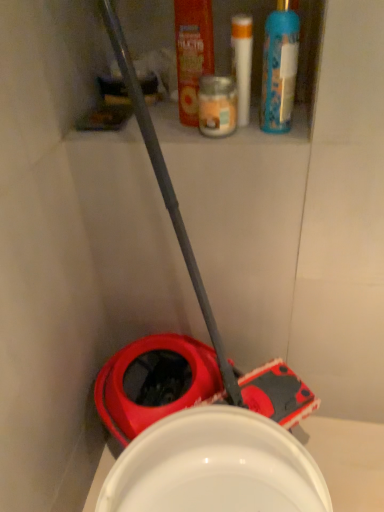
You are a GUI agent. You are given a task and a screenshot of the screen. Output one action in this format:
    pyautogui.click(x=<x>, y=<y>)
    Task: Click on the blue plastic spray bottle at upper right
    
    Given the screenshot: What is the action you would take?
    pyautogui.click(x=279, y=68)

What is the approximate width of orange plastic mouthwash at upper center?

It is 2.71 inches.

Where is `blue plastic spray bottle at upper right`? blue plastic spray bottle at upper right is located at coordinates (279, 68).

Which is closer to the camera, [227,77] or [180,20]?

Point [227,77] appears to be closer to the viewer than point [180,20].

Does translucent glass candle at upper center, arranged as the second toiletry when viewed from the right, turn towards orange plastic mouthwash at upper center?

No, translucent glass candle at upper center, arranged as the second toiletry when viewed from the right, is not turned towards orange plastic mouthwash at upper center.

Consider the image. Is translucent glass candle at upper center, arranged as the second toiletry when viewed from the right, taller than orange plastic mouthwash at upper center?

Incorrect, the height of translucent glass candle at upper center, arranged as the second toiletry when viewed from the right, is not larger of that of orange plastic mouthwash at upper center.

Based on the photo, is the position of white plastic tube at upper center, the 1th toiletry in the right-to-left sequence, more distant than that of blue plastic spray bottle at upper right?

Yes, it is behind blue plastic spray bottle at upper right.

Could you tell me if white plastic tube at upper center, which is counted as the second toiletry, starting from the left, is facing blue plastic spray bottle at upper right?

No, white plastic tube at upper center, which is counted as the second toiletry, starting from the left, is not aimed at blue plastic spray bottle at upper right.

Between point (243, 95) and point (273, 41), which one is positioned behind?

Point (273, 41)

Does orange plastic mouthwash at upper center appear on the right side of white plastic tube at upper center, the 1th toiletry in the right-to-left sequence?

Incorrect, orange plastic mouthwash at upper center is not on the right side of white plastic tube at upper center, the 1th toiletry in the right-to-left sequence.

Do you think orange plastic mouthwash at upper center is within white plastic tube at upper center, which is counted as the second toiletry, starting from the left, or outside of it?

orange plastic mouthwash at upper center is not inside white plastic tube at upper center, which is counted as the second toiletry, starting from the left, it's outside.

Looking at the image, does orange plastic mouthwash at upper center seem bigger or smaller compared to white plastic tube at upper center, which is counted as the second toiletry, starting from the left?

In the image, orange plastic mouthwash at upper center appears to be larger than white plastic tube at upper center, which is counted as the second toiletry, starting from the left.

Is orange plastic mouthwash at upper center wider or thinner than white plastic tube at upper center, the 1th toiletry in the right-to-left sequence?

orange plastic mouthwash at upper center is thinner than white plastic tube at upper center, the 1th toiletry in the right-to-left sequence.

Where is `cleaning product in front of the orange plastic mouthwash at upper center`? cleaning product in front of the orange plastic mouthwash at upper center is located at coordinates (279, 68).

Between blue plastic spray bottle at upper right and orange plastic mouthwash at upper center, which one has smaller size?

With smaller size is orange plastic mouthwash at upper center.

From the image's perspective, which is above, blue plastic spray bottle at upper right or orange plastic mouthwash at upper center?

orange plastic mouthwash at upper center.

Is blue plastic spray bottle at upper right in front of or behind orange plastic mouthwash at upper center in the image?

blue plastic spray bottle at upper right is in front of orange plastic mouthwash at upper center.

Does point (223, 133) appear closer or farther from the camera than point (277, 89)?

Point (223, 133).

Between translucent glass candle at upper center, the 1th toiletry when ordered from left to right, and blue plastic spray bottle at upper right, which one has larger size?

Bigger between the two is blue plastic spray bottle at upper right.

Is translucent glass candle at upper center, the 1th toiletry when ordered from left to right, facing towards blue plastic spray bottle at upper right?

No, translucent glass candle at upper center, the 1th toiletry when ordered from left to right, is not aimed at blue plastic spray bottle at upper right.

Which object is positioned more to the right, translucent glass candle at upper center, arranged as the second toiletry when viewed from the right, or blue plastic spray bottle at upper right?

Positioned to the right is blue plastic spray bottle at upper right.

Do you think white plastic tube at upper center, the 1th toiletry in the right-to-left sequence, is within orange plastic mouthwash at upper center, or outside of it?

The correct answer is: outside.

Is white plastic tube at upper center, which is counted as the second toiletry, starting from the left, placed right next to orange plastic mouthwash at upper center?

Yes, white plastic tube at upper center, which is counted as the second toiletry, starting from the left, is touching orange plastic mouthwash at upper center.

From the image's perspective, which is below, white plastic tube at upper center, the 1th toiletry in the right-to-left sequence, or orange plastic mouthwash at upper center?

white plastic tube at upper center, the 1th toiletry in the right-to-left sequence, is shown below in the image.

Measure the distance from blue plastic spray bottle at upper right to translucent glass candle at upper center, the 1th toiletry when ordered from left to right.

11.80 centimeters.

Is blue plastic spray bottle at upper right oriented towards translucent glass candle at upper center, the 1th toiletry when ordered from left to right?

No.

This screenshot has height=512, width=384. I want to click on cleaning product located on the right of translucent glass candle at upper center, the 1th toiletry when ordered from left to right, so click(x=279, y=68).

Who is smaller, blue plastic spray bottle at upper right or translucent glass candle at upper center, arranged as the second toiletry when viewed from the right?

translucent glass candle at upper center, arranged as the second toiletry when viewed from the right, is smaller.

Locate an element on the screen. mouthwash above the translucent glass candle at upper center, the 1th toiletry when ordered from left to right (from a real-world perspective) is located at coordinates (192, 54).

I want to click on cleaning product that appears in front of the white plastic tube at upper center, which is counted as the second toiletry, starting from the left, so click(279, 68).

From the picture: Estimate the real-world distances between objects in this image. Which object is further from orange plastic mouthwash at upper center, blue plastic spray bottle at upper right or white plastic tube at upper center, which is counted as the second toiletry, starting from the left?

blue plastic spray bottle at upper right is further to orange plastic mouthwash at upper center.

Which object lies nearer to the anchor point translucent glass candle at upper center, the 1th toiletry when ordered from left to right, blue plastic spray bottle at upper right or orange plastic mouthwash at upper center?

orange plastic mouthwash at upper center.

From the image, which object appears to be nearer to white plastic tube at upper center, which is counted as the second toiletry, starting from the left, orange plastic mouthwash at upper center or blue plastic spray bottle at upper right?

blue plastic spray bottle at upper right is closer to white plastic tube at upper center, which is counted as the second toiletry, starting from the left.

Considering their positions, is blue plastic spray bottle at upper right positioned closer to white plastic tube at upper center, which is counted as the second toiletry, starting from the left, than orange plastic mouthwash at upper center?

blue plastic spray bottle at upper right lies closer to white plastic tube at upper center, which is counted as the second toiletry, starting from the left, than the other object.

Considering their positions, is blue plastic spray bottle at upper right positioned further to white plastic tube at upper center, the 1th toiletry in the right-to-left sequence, than translucent glass candle at upper center, arranged as the second toiletry when viewed from the right?

translucent glass candle at upper center, arranged as the second toiletry when viewed from the right, lies further to white plastic tube at upper center, the 1th toiletry in the right-to-left sequence, than the other object.

Based on their spatial positions, is orange plastic mouthwash at upper center or white plastic tube at upper center, which is counted as the second toiletry, starting from the left, closer to blue plastic spray bottle at upper right?

Among the two, white plastic tube at upper center, which is counted as the second toiletry, starting from the left, is located nearer to blue plastic spray bottle at upper right.

Looking at this image, when comparing their distances from white plastic tube at upper center, which is counted as the second toiletry, starting from the left, does orange plastic mouthwash at upper center or translucent glass candle at upper center, the 1th toiletry when ordered from left to right, seem closer?

orange plastic mouthwash at upper center lies closer to white plastic tube at upper center, which is counted as the second toiletry, starting from the left, than the other object.

From the image, which object appears to be nearer to orange plastic mouthwash at upper center, blue plastic spray bottle at upper right or translucent glass candle at upper center, the 1th toiletry when ordered from left to right?

The object closer to orange plastic mouthwash at upper center is translucent glass candle at upper center, the 1th toiletry when ordered from left to right.

Locate an element on the screen. toiletry between translucent glass candle at upper center, the 1th toiletry when ordered from left to right, and blue plastic spray bottle at upper right, in the horizontal direction is located at coordinates (242, 63).

At what (x,y) coordinates should I click in order to perform the action: click on toiletry that lies between orange plastic mouthwash at upper center and translucent glass candle at upper center, the 1th toiletry when ordered from left to right, from top to bottom. Please return your answer as a coordinate pair (x, y). The image size is (384, 512). Looking at the image, I should click on (242, 63).